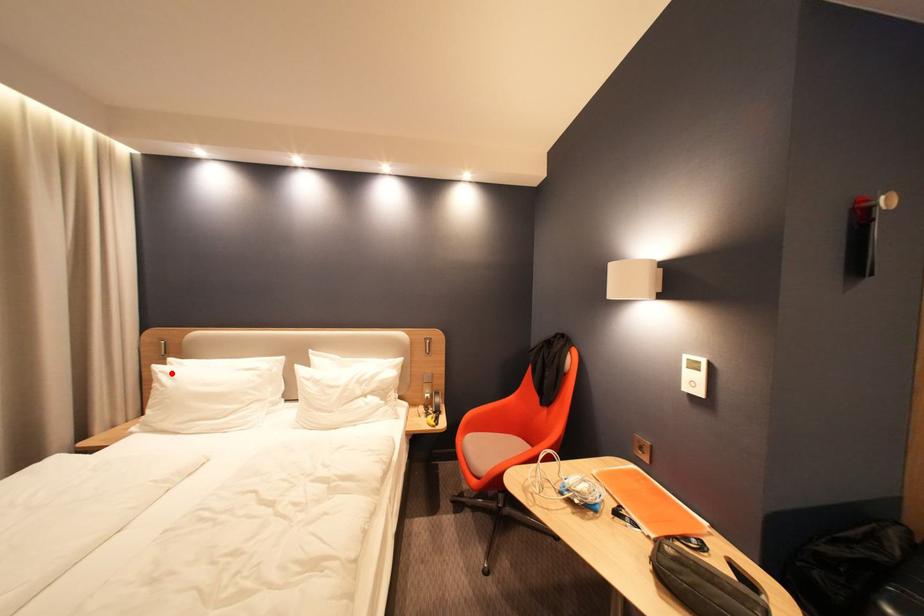
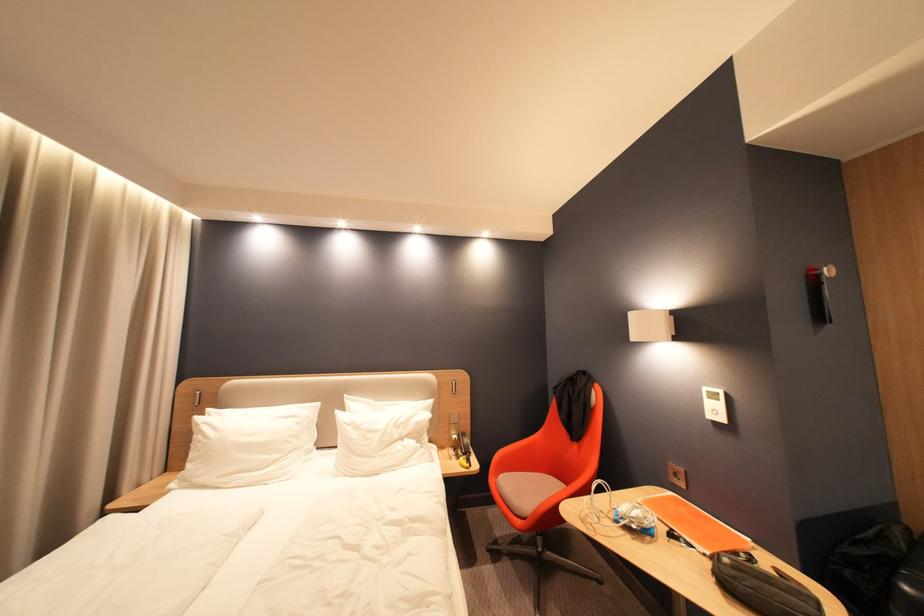
Find the pixel in the second image that matches the highlighted location in the first image.

(213, 424)